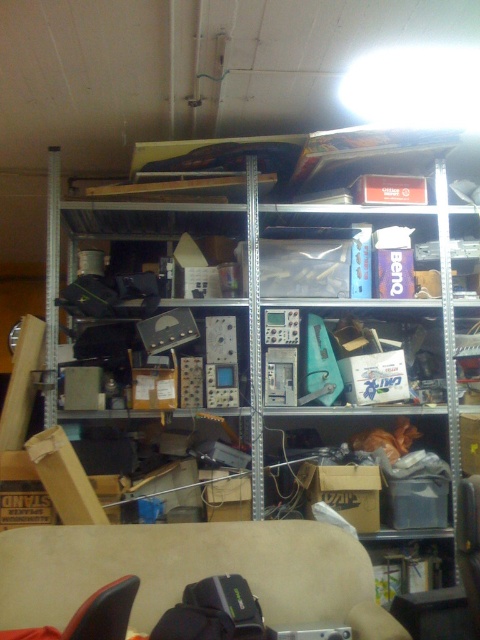
Based on the photo, is metallic gray electronics at center to the left of beige fabric couch at lower center from the viewer's perspective?

In fact, metallic gray electronics at center is to the right of beige fabric couch at lower center.

Between point (351, 436) and point (72, 576), which one is positioned in front?

Positioned in front is point (72, 576).

The image size is (480, 640). I want to click on metallic gray electronics at center, so click(x=298, y=324).